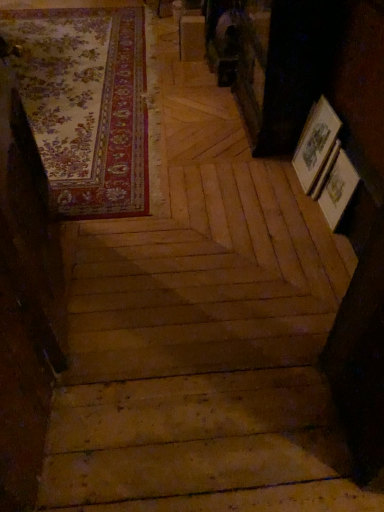
The width and height of the screenshot is (384, 512). What do you see at coordinates (196, 378) in the screenshot? I see `wooden stairs at center` at bounding box center [196, 378].

You are a GUI agent. You are given a task and a screenshot of the screen. Output one action in this format:
    pyautogui.click(x=<x>, y=<y>)
    Task: Click on the wooden stairs at center
    The width and height of the screenshot is (384, 512).
    Given the screenshot: What is the action you would take?
    pyautogui.click(x=196, y=378)

Describe the element at coordinates (86, 104) in the screenshot. This screenshot has width=384, height=512. I see `floral carpet at upper left` at that location.

You are a GUI agent. You are given a task and a screenshot of the screen. Output one action in this format:
    pyautogui.click(x=<x>, y=<y>)
    Task: Click on the floral carpet at upper left
    This screenshot has width=384, height=512.
    Given the screenshot: What is the action you would take?
    pyautogui.click(x=86, y=104)

Identify the location of wooden stairs at center. (196, 378).

Consider the image. Considering the positions of objects wooden stairs at center and floral carpet at upper left in the image provided, who is more to the left, wooden stairs at center or floral carpet at upper left?

From the viewer's perspective, floral carpet at upper left appears more on the left side.

Considering their positions, is wooden stairs at center located in front of or behind floral carpet at upper left?

In the image, wooden stairs at center appears in front of floral carpet at upper left.

Between point (289, 386) and point (88, 90), which one is positioned in front?

The point (289, 386) is more forward.

From the image's perspective, is wooden stairs at center located beneath floral carpet at upper left?

Correct, wooden stairs at center appears lower than floral carpet at upper left in the image.

From a real-world perspective, which is physically below, wooden stairs at center or floral carpet at upper left?

floral carpet at upper left.

Does wooden stairs at center have a greater width compared to floral carpet at upper left?

Correct, the width of wooden stairs at center exceeds that of floral carpet at upper left.

In terms of height, does wooden stairs at center look taller or shorter compared to floral carpet at upper left?

In the image, wooden stairs at center appears to be shorter than floral carpet at upper left.

Is wooden stairs at center smaller than floral carpet at upper left?

Incorrect, wooden stairs at center is not smaller in size than floral carpet at upper left.

Is floral carpet at upper left a part of wooden stairs at center?

Absolutely, floral carpet at upper left is inside wooden stairs at center.

Are wooden stairs at center and floral carpet at upper left located far from each other?

Indeed, wooden stairs at center is not near floral carpet at upper left.

Is floral carpet at upper left at the back of wooden stairs at center?

That's right, wooden stairs at center is facing away from floral carpet at upper left.

How many degrees apart are the facing directions of wooden stairs at center and floral carpet at upper left?

7.74e-05 degrees.

There is a floral carpet at upper left. Where is `stairwell above it (from a real-world perspective)`? The height and width of the screenshot is (512, 384). stairwell above it (from a real-world perspective) is located at coordinates (196, 378).

Based on their positions, is floral carpet at upper left located to the left or right of wooden stairs at center?

In the image, floral carpet at upper left appears on the left side of wooden stairs at center.

In the scene shown: Considering their positions, is floral carpet at upper left located in front of or behind wooden stairs at center?

In the image, floral carpet at upper left appears behind wooden stairs at center.

Is point (22, 32) farther from camera compared to point (83, 291)?

Yes, it is behind point (83, 291).

From the image's perspective, is floral carpet at upper left above or below wooden stairs at center?

From the image's perspective, floral carpet at upper left appears above wooden stairs at center.

From a real-world perspective, does floral carpet at upper left stand above wooden stairs at center?

Incorrect, from a real-world perspective, floral carpet at upper left is lower than wooden stairs at center.

Considering the sizes of objects floral carpet at upper left and wooden stairs at center in the image provided, who is thinner, floral carpet at upper left or wooden stairs at center?

floral carpet at upper left.

Considering the relative sizes of floral carpet at upper left and wooden stairs at center in the image provided, is floral carpet at upper left taller than wooden stairs at center?

Yes, floral carpet at upper left is taller than wooden stairs at center.

Considering the sizes of objects floral carpet at upper left and wooden stairs at center in the image provided, who is bigger, floral carpet at upper left or wooden stairs at center?

wooden stairs at center is bigger.

Is floral carpet at upper left surrounding wooden stairs at center?

Yes, wooden stairs at center is a part of floral carpet at upper left.

Is floral carpet at upper left with wooden stairs at center?

No, floral carpet at upper left is not making contact with wooden stairs at center.

Could you tell me if floral carpet at upper left is facing wooden stairs at center?

Yes, floral carpet at upper left is aimed at wooden stairs at center.

What's the angular difference between floral carpet at upper left and wooden stairs at center's facing directions?

7.74e-05 degrees separate the facing orientations of floral carpet at upper left and wooden stairs at center.

Locate an element on the screen. This screenshot has width=384, height=512. stairwell below the floral carpet at upper left (from the image's perspective) is located at coordinates (196, 378).

The image size is (384, 512). What are the coordinates of `mat above the wooden stairs at center (from the image's perspective)` in the screenshot? It's located at tap(86, 104).

The width and height of the screenshot is (384, 512). In order to click on mat to the left of wooden stairs at center in this screenshot , I will do `click(86, 104)`.